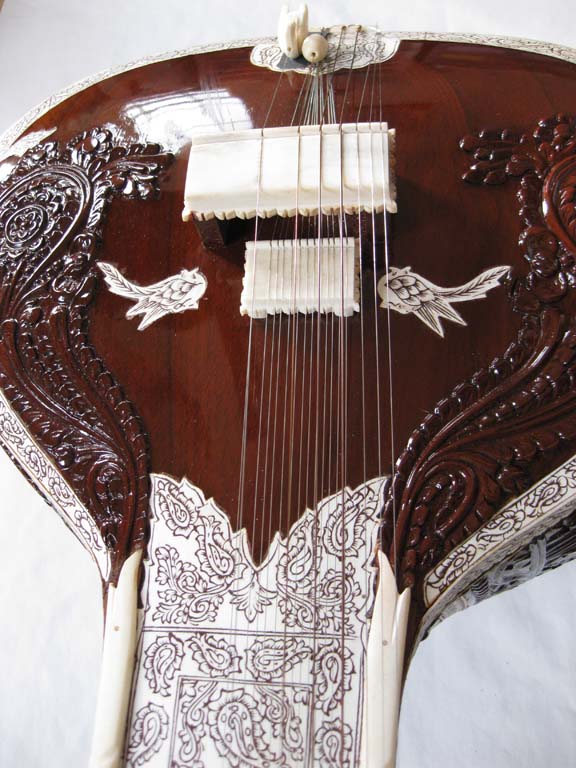
The width and height of the screenshot is (576, 768). What are the coordinates of `carved details` in the screenshot? It's located at (60, 240), (549, 277).